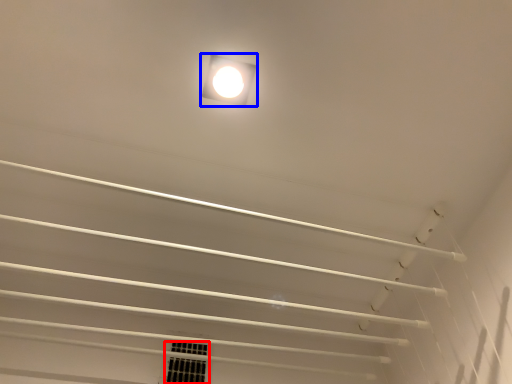
Question: Among these objects, which one is farthest to the camera, window (highlighted by a red box) or lamp (highlighted by a blue box)?

Choices:
 (A) window
 (B) lamp

Answer: (A)